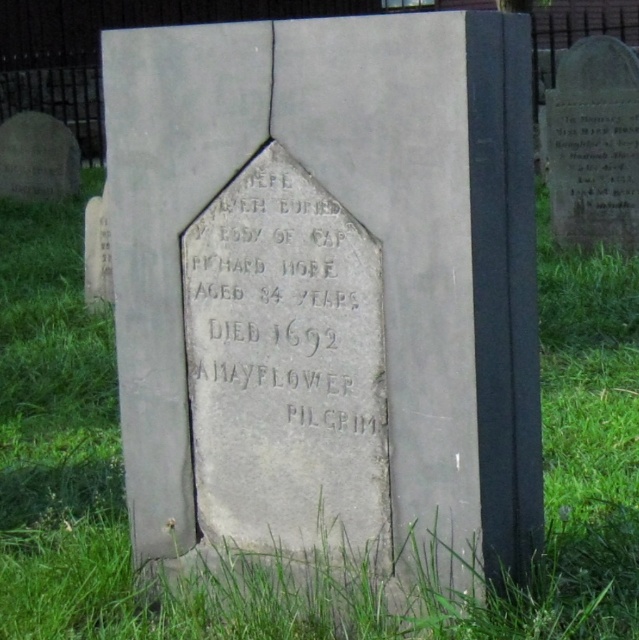
Which is more to the right, gray stone inscription at center or gray stone gravestone at upper right?

From the viewer's perspective, gray stone gravestone at upper right appears more on the right side.

Locate an element on the screen. The height and width of the screenshot is (640, 639). gray stone inscription at center is located at coordinates (282, 314).